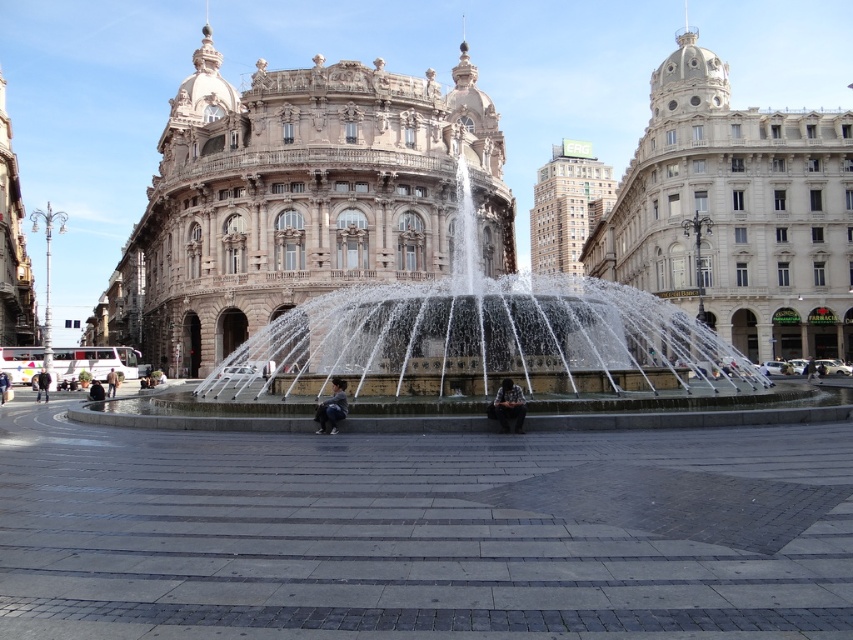
Does marble stone palace at center have a greater width compared to brown leather jacket at center?

Correct, the width of marble stone palace at center exceeds that of brown leather jacket at center.

Is point (421, 164) positioned after point (111, 381)?

That is True.

Describe the element at coordinates (299, 198) in the screenshot. The height and width of the screenshot is (640, 853). I see `marble stone palace at center` at that location.

Locate an element on the screen. The height and width of the screenshot is (640, 853). marble stone palace at center is located at coordinates (299, 198).

The height and width of the screenshot is (640, 853). Find the location of `white marble building at center`. white marble building at center is located at coordinates (735, 212).

Does white marble building at center have a greater width compared to dark gray fabric jacket at center?

Correct, the width of white marble building at center exceeds that of dark gray fabric jacket at center.

Which is in front, point (839, 317) or point (508, 400)?

Point (508, 400) is more forward.

Identify the location of white marble building at center. (735, 212).

Between point (473, 534) and point (44, 385), which one is positioned behind?

Positioned behind is point (44, 385).

Does point (440, 628) lie in front of point (45, 380)?

That is True.

Locate an element on the screen. The image size is (853, 640). gray stone pavement at center is located at coordinates (422, 532).